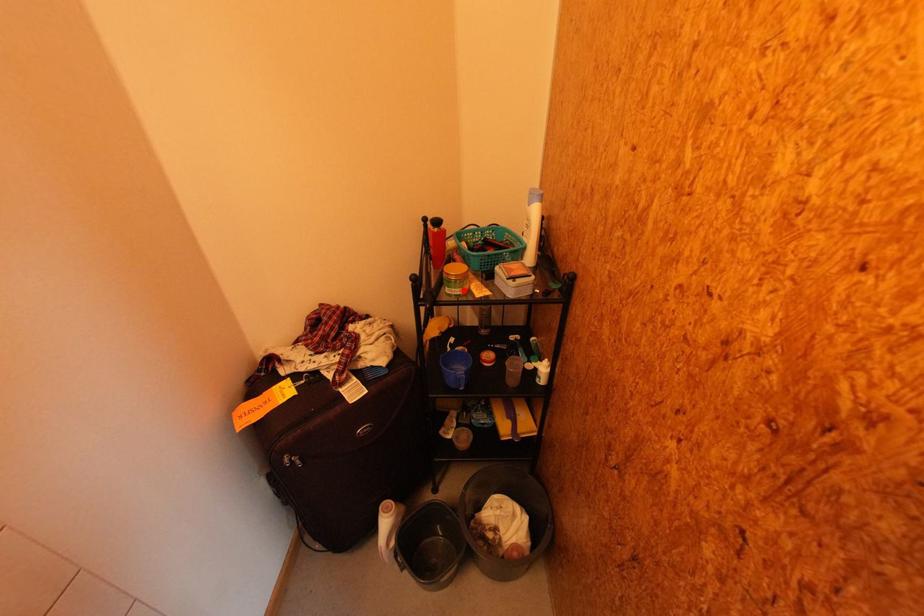
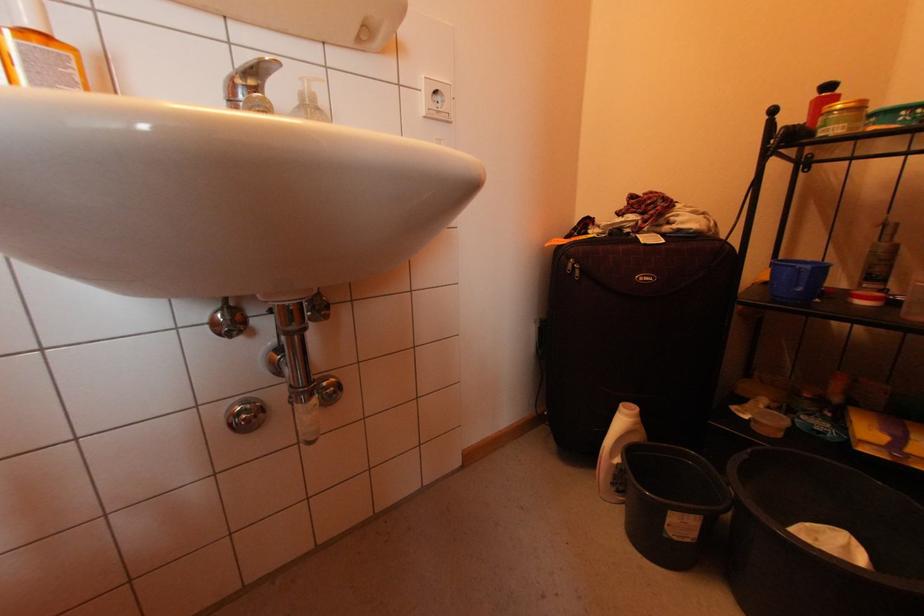
Question: I am providing you with two images of the same scene from different viewpoints. Given a red point in image1, look at the same physical point in image2. Is it:

Choices:
 (A) Closer to the viewpoint
 (B) Farther from the viewpoint

Answer: (B)